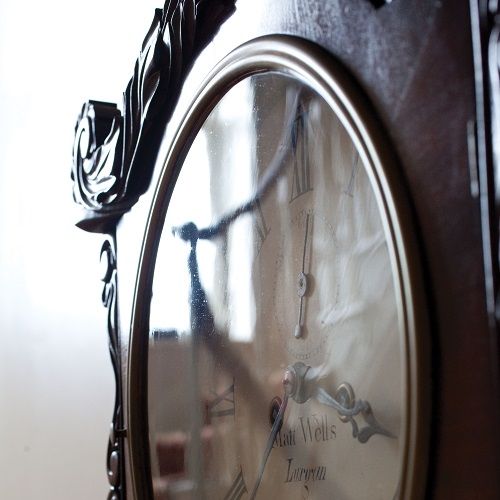
This screenshot has height=500, width=500. In order to click on hour hand of clock in this screenshot , I will do `click(346, 413)`.